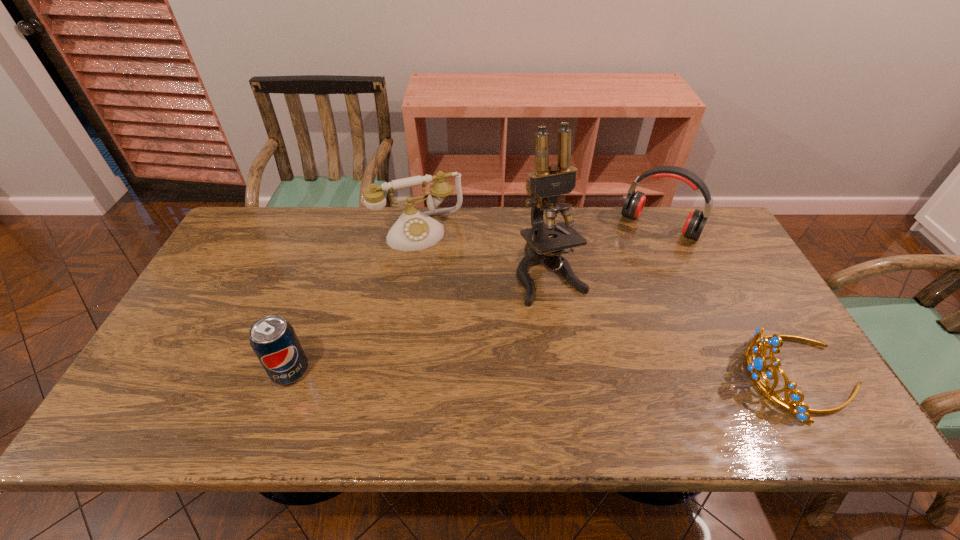
You are a GUI agent. You are given a task and a screenshot of the screen. Output one action in this format:
    pyautogui.click(x=<x>, y=<y>)
    Task: Click on the telephone that is at the far edge
    The height and width of the screenshot is (540, 960).
    Given the screenshot: What is the action you would take?
    pyautogui.click(x=414, y=230)

This screenshot has width=960, height=540. What are the coordinates of `earphone that is at the far edge` in the screenshot? It's located at (634, 203).

Find the location of a particular element. Image resolution: width=960 pixels, height=540 pixels. soda can located at the near edge is located at coordinates (274, 341).

Find the location of a particular element. tiara present at the near edge is located at coordinates (755, 369).

Find the location of a particular element. tiara that is at the right edge is located at coordinates (755, 369).

Locate an element on the screen. earphone at the right edge is located at coordinates (634, 203).

Find the location of `object located at the far right corner`. object located at the far right corner is located at coordinates (634, 203).

Where is `object that is positioned at the near right corner`? The height and width of the screenshot is (540, 960). object that is positioned at the near right corner is located at coordinates (755, 369).

Find the location of a particular element. This screenshot has height=540, width=960. free region at the far edge is located at coordinates (669, 237).

Where is `vacant region at the left edge`? This screenshot has width=960, height=540. vacant region at the left edge is located at coordinates (194, 307).